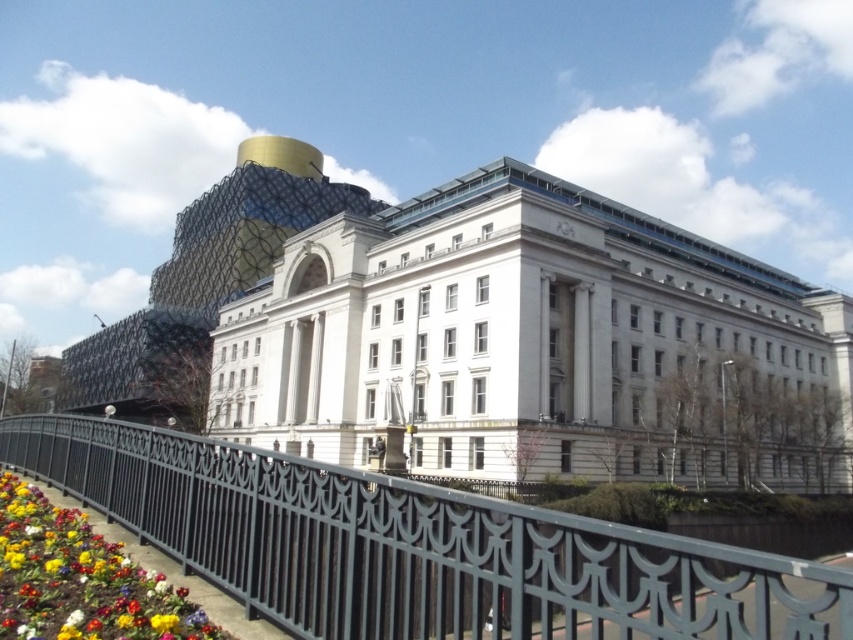
Can you confirm if white stone building at center is thinner than multicolored fabric flower at lower left?

In fact, white stone building at center might be wider than multicolored fabric flower at lower left.

The height and width of the screenshot is (640, 853). In order to click on white stone building at center in this screenshot , I will do `click(515, 337)`.

Identify the location of white stone building at center. (515, 337).

Is point (242, 538) farther from camera compared to point (117, 608)?

Yes, point (242, 538) is farther from viewer.

In the scene shown: Is black wrought iron railing at center to the right of multicolored fabric flower at lower left from the viewer's perspective?

Yes, black wrought iron railing at center is to the right of multicolored fabric flower at lower left.

Who is more forward, (613, 570) or (103, 598)?

Point (613, 570) is in front.

Where is `black wrought iron railing at center`? The image size is (853, 640). black wrought iron railing at center is located at coordinates 415,547.

Between point (245, 435) and point (611, 616), which one is positioned behind?

The point (245, 435) is more distant.

Who is higher up, white stone building at center or black wrought iron railing at center?

white stone building at center

Between point (531, 356) and point (496, 566), which one is positioned behind?

Positioned behind is point (531, 356).

Identify the location of white stone building at center. point(515,337).